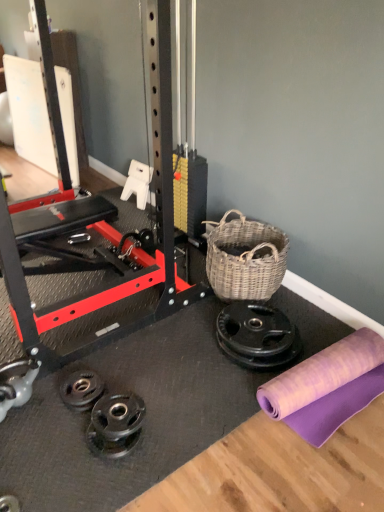
Locate an element on the screen. This screenshot has height=512, width=384. black rubber weight plate at lower left is located at coordinates point(81,389).

What do you see at coordinates (245, 259) in the screenshot? I see `woven natural basket at center-right` at bounding box center [245, 259].

Locate an element on the screen. The height and width of the screenshot is (512, 384). black rubber weight plate at lower left is located at coordinates (81, 389).

From the image's perspective, which object appears higher, purple fabric at lower right or black rubber weight plate at lower left?

purple fabric at lower right.

Considering the relative sizes of purple fabric at lower right and black rubber weight plate at lower left in the image provided, is purple fabric at lower right wider than black rubber weight plate at lower left?

Correct, the width of purple fabric at lower right exceeds that of black rubber weight plate at lower left.

From a real-world perspective, between purple fabric at lower right and black rubber weight plate at lower left, who is vertically higher?

purple fabric at lower right.

Is point (297, 400) positioned before point (93, 371)?

Yes, point (297, 400) is closer to viewer.

Consider the image. Is black rubber weight plate at lower left not close to purple fabric at lower right?

They are positioned close to each other.

From a real-world perspective, is black rubber weight plate at lower left beneath purple fabric at lower right?

Yes.

Can we say black rubber weight plate at lower left lies outside purple fabric at lower right?

Yes.

Where is `fabric below the woven natural basket at center-right (from the image's perspective)`? The width and height of the screenshot is (384, 512). fabric below the woven natural basket at center-right (from the image's perspective) is located at coordinates (327, 386).

How many degrees apart are the facing directions of woven natural basket at center-right and purple fabric at lower right?

4.27 degrees.

Which point is more distant from viewer, (225, 283) or (335, 351)?

Point (225, 283)

Is the surface of woven natural basket at center-right in direct contact with purple fabric at lower right?

No, woven natural basket at center-right is not with purple fabric at lower right.

Identify the location of basket that appears on the right of black rubber weight plate at lower left. The height and width of the screenshot is (512, 384). (245, 259).

Which object is thinner, woven natural basket at center-right or black rubber weight plate at lower left?

black rubber weight plate at lower left.

Between woven natural basket at center-right and black rubber weight plate at lower left, which one appears on the right side from the viewer's perspective?

From the viewer's perspective, woven natural basket at center-right appears more on the right side.

From a real-world perspective, is woven natural basket at center-right located higher than black rubber weight plate at lower left?

Correct, in the physical world, woven natural basket at center-right is higher than black rubber weight plate at lower left.

At what (x,y) coordinates should I click in order to perform the action: click on basket above the black rubber weight plate at lower left (from a real-world perspective). Please return your answer as a coordinate pair (x, y). This screenshot has width=384, height=512. Looking at the image, I should click on (245, 259).

From the image's perspective, does black rubber weight plate at lower left appear lower than woven natural basket at center-right?

Yes, from the image's perspective, black rubber weight plate at lower left is below woven natural basket at center-right.

Considering the points (89, 387) and (233, 262), which point is in front, point (89, 387) or point (233, 262)?

The point (89, 387) is closer to the camera.

Can you tell me how much black rubber weight plate at lower left and woven natural basket at center-right differ in facing direction?

They differ by 4.27 degrees in their facing directions.

Who is smaller, purple fabric at lower right or woven natural basket at center-right?

Smaller between the two is woven natural basket at center-right.

Can you confirm if purple fabric at lower right is thinner than woven natural basket at center-right?

No.

From the image's perspective, is purple fabric at lower right beneath woven natural basket at center-right?

Yes, from the image's perspective, purple fabric at lower right is beneath woven natural basket at center-right.

Based on the photo, considering the sizes of objects purple fabric at lower right and woven natural basket at center-right in the image provided, who is taller, purple fabric at lower right or woven natural basket at center-right?

purple fabric at lower right.

At what (x,y) coordinates should I click in order to perform the action: click on wheel located behind the purple fabric at lower right. Please return your answer as a coordinate pair (x, y). The height and width of the screenshot is (512, 384). Looking at the image, I should click on (81, 389).

Where is `fabric on the right of black rubber weight plate at lower left`? The height and width of the screenshot is (512, 384). fabric on the right of black rubber weight plate at lower left is located at coordinates (327, 386).

Looking at the image, which one is located further to black rubber weight plate at lower left, purple fabric at lower right or woven natural basket at center-right?

woven natural basket at center-right is positioned further to the anchor black rubber weight plate at lower left.

Considering their positions, is woven natural basket at center-right positioned further to black rubber weight plate at lower left than purple fabric at lower right?

woven natural basket at center-right is positioned further to the anchor black rubber weight plate at lower left.

Looking at the image, which one is located closer to purple fabric at lower right, black rubber weight plate at lower left or woven natural basket at center-right?

woven natural basket at center-right lies closer to purple fabric at lower right than the other object.

From the image, which object appears to be farther from woven natural basket at center-right, purple fabric at lower right or black rubber weight plate at lower left?

Among the two, black rubber weight plate at lower left is located further to woven natural basket at center-right.

Consider the image. Estimate the real-world distances between objects in this image. Which object is further from purple fabric at lower right, woven natural basket at center-right or black rubber weight plate at lower left?

Based on the image, black rubber weight plate at lower left appears to be further to purple fabric at lower right.

Which object lies nearer to the anchor point woven natural basket at center-right, black rubber weight plate at lower left or purple fabric at lower right?

purple fabric at lower right.

This screenshot has height=512, width=384. Identify the location of basket between black rubber weight plate at lower left and purple fabric at lower right. (245, 259).